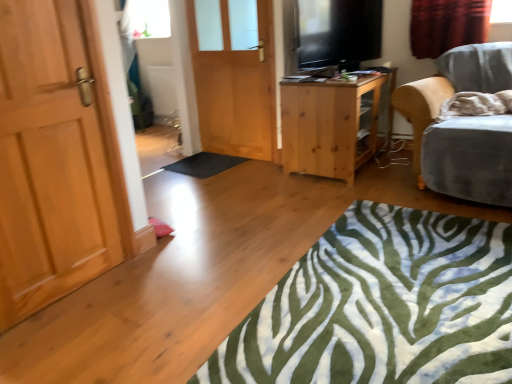
What are the coordinates of `empty space that is in between light brown wooden door at left, the 1th door from the left, and green zebra-patterned rug at lower center` in the screenshot? It's located at (199, 278).